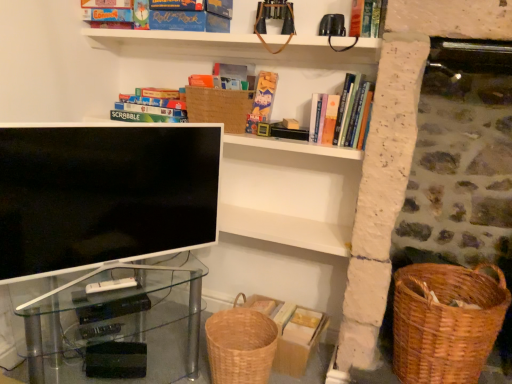
What do you see at coordinates (151, 106) in the screenshot? This screenshot has width=512, height=384. I see `matte cardboard scrabble board game at upper left, which is the first book from left to right` at bounding box center [151, 106].

Locate an element on the screen. The image size is (512, 384). matte cardboard book at upper center, the second book in the left-to-right sequence is located at coordinates (262, 101).

Locate an element on the screen. hardcover book at upper center, which is the fourth book in left-to-right order is located at coordinates coord(365,18).

Locate an element on the screen. transparent glass computer desk at lower left is located at coordinates (115, 322).

Describe the element at coordinates (342, 113) in the screenshot. The image size is (512, 384). I see `hardcover book at upper right, marked as the second book in a right-to-left arrangement` at that location.

Identify the location of hardcover book at upper right, marked as the second book in a right-to-left arrangement. Image resolution: width=512 pixels, height=384 pixels. (342, 113).

Where is `woven brown basket at lower right, positioned as the 1th basket container in right-to-left order`? The image size is (512, 384). woven brown basket at lower right, positioned as the 1th basket container in right-to-left order is located at coordinates (446, 322).

In order to face woven brown basket at lower center, arranged as the 2th basket container when viewed from the right, should I rotate leftwards or rightwards?

To align with it, rotate left about 2.367°.

Describe the element at coordinates (240, 345) in the screenshot. I see `woven brown basket at lower center, positioned as the first basket container in left-to-right order` at that location.

Locate an element on the screen. matte cardboard scrabble board game at upper left, which is the fourth book from right to left is located at coordinates (151, 106).

From the image's perspective, between woven brown basket at lower right, positioned as the 1th basket container in right-to-left order, and matte cardboard book at upper center, positioned as the third book in right-to-left order, who is located below?

woven brown basket at lower right, positioned as the 1th basket container in right-to-left order, is shown below in the image.

Considering their positions, is woven brown basket at lower right, positioned as the 1th basket container in right-to-left order, located in front of or behind matte cardboard book at upper center, the second book in the left-to-right sequence?

Clearly, woven brown basket at lower right, positioned as the 1th basket container in right-to-left order, is in front of matte cardboard book at upper center, the second book in the left-to-right sequence.

Which of these two, woven brown basket at lower right, positioned as the 1th basket container in right-to-left order, or matte cardboard book at upper center, positioned as the third book in right-to-left order, is smaller?

With smaller size is matte cardboard book at upper center, positioned as the third book in right-to-left order.

Is woven brown basket at lower center, positioned as the first basket container in left-to-right order, next to matte white tv at center and touching it?

No, woven brown basket at lower center, positioned as the first basket container in left-to-right order, is not in contact with matte white tv at center.

Based on the photo, from the image's perspective, who appears lower, woven brown basket at lower center, positioned as the first basket container in left-to-right order, or matte white tv at center?

woven brown basket at lower center, positioned as the first basket container in left-to-right order, from the image's perspective.

In terms of size, does woven brown basket at lower center, arranged as the 2th basket container when viewed from the right, appear bigger or smaller than matte white tv at center?

In the image, woven brown basket at lower center, arranged as the 2th basket container when viewed from the right, appears to be smaller than matte white tv at center.

Would you say woven brown basket at lower center, arranged as the 2th basket container when viewed from the right, is to the left or to the right of matte white tv at center in the picture?

From the image, it's evident that woven brown basket at lower center, arranged as the 2th basket container when viewed from the right, is to the right of matte white tv at center.

Which object is positioned more to the left, hardcover book at upper right, marked as the second book in a right-to-left arrangement, or woven brown basket at lower right, positioned as the 1th basket container in right-to-left order?

Positioned to the left is hardcover book at upper right, marked as the second book in a right-to-left arrangement.

Can you confirm if hardcover book at upper right, marked as the 3th book in a left-to-right arrangement, is wider than woven brown basket at lower right, positioned as the 1th basket container in right-to-left order?

In fact, hardcover book at upper right, marked as the 3th book in a left-to-right arrangement, might be narrower than woven brown basket at lower right, positioned as the 1th basket container in right-to-left order.

From a real-world perspective, is hardcover book at upper right, marked as the second book in a right-to-left arrangement, below woven brown basket at lower right, arranged as the second basket container when viewed from the left?

No, from a real-world perspective, hardcover book at upper right, marked as the second book in a right-to-left arrangement, is not below woven brown basket at lower right, arranged as the second basket container when viewed from the left.

Can we say hardcover book at upper right, marked as the second book in a right-to-left arrangement, lies outside woven brown basket at lower right, positioned as the 1th basket container in right-to-left order?

Indeed, hardcover book at upper right, marked as the second book in a right-to-left arrangement, is completely outside woven brown basket at lower right, positioned as the 1th basket container in right-to-left order.

From the image's perspective, does matte cardboard scrabble board game at upper left, which is the fourth book from right to left, appear lower than matte cardboard book at upper center, positioned as the third book in right-to-left order?

No, from the image's perspective, matte cardboard scrabble board game at upper left, which is the fourth book from right to left, is not beneath matte cardboard book at upper center, positioned as the third book in right-to-left order.

Which of these two, matte cardboard scrabble board game at upper left, which is the fourth book from right to left, or matte cardboard book at upper center, the second book in the left-to-right sequence, is wider?

matte cardboard book at upper center, the second book in the left-to-right sequence, is wider.

How distant is matte cardboard scrabble board game at upper left, which is the fourth book from right to left, from matte cardboard book at upper center, positioned as the third book in right-to-left order?

42.86 centimeters.

Which is more to the left, matte cardboard scrabble board game at upper left, which is the fourth book from right to left, or matte cardboard book at upper center, positioned as the third book in right-to-left order?

From the viewer's perspective, matte cardboard scrabble board game at upper left, which is the fourth book from right to left, appears more on the left side.

Is matte white tv at center aimed at woven brown basket at upper center?

No, matte white tv at center is not facing towards woven brown basket at upper center.

Is matte white tv at center beside woven brown basket at upper center?

matte white tv at center and woven brown basket at upper center are clearly separated.

Is matte white tv at center to the left or to the right of woven brown basket at upper center in the image?

matte white tv at center is positioned on woven brown basket at upper center's left side.

Is hardcover book at upper right, marked as the 3th book in a left-to-right arrangement, facing towards woven brown basket at upper center?

No, hardcover book at upper right, marked as the 3th book in a left-to-right arrangement, does not turn towards woven brown basket at upper center.

Considering the sizes of objects hardcover book at upper right, marked as the 3th book in a left-to-right arrangement, and woven brown basket at upper center in the image provided, who is wider, hardcover book at upper right, marked as the 3th book in a left-to-right arrangement, or woven brown basket at upper center?

hardcover book at upper right, marked as the 3th book in a left-to-right arrangement.

Consider the image. Considering the sizes of objects hardcover book at upper right, marked as the 3th book in a left-to-right arrangement, and woven brown basket at upper center in the image provided, who is bigger, hardcover book at upper right, marked as the 3th book in a left-to-right arrangement, or woven brown basket at upper center?

woven brown basket at upper center is bigger.

From a real-world perspective, who is located higher, hardcover book at upper right, marked as the second book in a right-to-left arrangement, or woven brown basket at upper center?

In real-world perspective, hardcover book at upper right, marked as the second book in a right-to-left arrangement, is above.

Is point (481, 265) closer to camera compared to point (144, 106)?

Yes.

From the image's perspective, which one is positioned lower, woven brown basket at lower right, positioned as the 1th basket container in right-to-left order, or matte cardboard scrabble board game at upper left, which is the first book from left to right?

woven brown basket at lower right, positioned as the 1th basket container in right-to-left order, is shown below in the image.

Is matte cardboard scrabble board game at upper left, which is the fourth book from right to left, at the back of woven brown basket at lower right, arranged as the second basket container when viewed from the left?

No, woven brown basket at lower right, arranged as the second basket container when viewed from the left, is not facing the opposite direction of matte cardboard scrabble board game at upper left, which is the fourth book from right to left.

Considering the relative positions of woven brown basket at lower right, arranged as the second basket container when viewed from the left, and matte cardboard scrabble board game at upper left, which is the fourth book from right to left, in the image provided, is woven brown basket at lower right, arranged as the second basket container when viewed from the left, in front of matte cardboard scrabble board game at upper left, which is the fourth book from right to left,?

Yes, it is in front of matte cardboard scrabble board game at upper left, which is the fourth book from right to left.

The image size is (512, 384). I want to click on basket container that is the 1st one below the matte cardboard book at upper center, positioned as the third book in right-to-left order (from a real-world perspective), so click(x=446, y=322).

From the image's perspective, starting from the matte white tv at center, which basket container is the 2nd one below? Please provide its 2D coordinates.

[(240, 345)]

Which object lies further to the anchor point transparent glass computer desk at lower left, hardcover book at upper right, marked as the 3th book in a left-to-right arrangement, or woven brown basket at lower center, arranged as the 2th basket container when viewed from the right?

Among the two, hardcover book at upper right, marked as the 3th book in a left-to-right arrangement, is located further to transparent glass computer desk at lower left.

Based on their spatial positions, is matte cardboard scrabble board game at upper left, which is the first book from left to right, or hardcover book at upper right, marked as the 3th book in a left-to-right arrangement, further from matte cardboard book at upper center, the second book in the left-to-right sequence?

matte cardboard scrabble board game at upper left, which is the first book from left to right, lies further to matte cardboard book at upper center, the second book in the left-to-right sequence, than the other object.

Considering their positions, is woven brown basket at lower center, positioned as the first basket container in left-to-right order, positioned further to matte cardboard scrabble board game at upper left, which is the first book from left to right, than woven brown basket at lower right, positioned as the 1th basket container in right-to-left order?

woven brown basket at lower right, positioned as the 1th basket container in right-to-left order, is positioned further to the anchor matte cardboard scrabble board game at upper left, which is the first book from left to right.

Estimate the real-world distances between objects in this image. Which object is closer to hardcover book at upper right, marked as the 3th book in a left-to-right arrangement, hardcover book at upper center, which is the fourth book in left-to-right order, or woven brown basket at upper center?

Based on the image, hardcover book at upper center, which is the fourth book in left-to-right order, appears to be nearer to hardcover book at upper right, marked as the 3th book in a left-to-right arrangement.

Estimate the real-world distances between objects in this image. Which object is closer to woven brown basket at lower center, positioned as the first basket container in left-to-right order, woven brown basket at upper center or matte cardboard scrabble board game at upper left, which is the first book from left to right?

woven brown basket at upper center lies closer to woven brown basket at lower center, positioned as the first basket container in left-to-right order, than the other object.

When comparing their distances from woven brown basket at upper center, does woven brown basket at lower center, positioned as the first basket container in left-to-right order, or matte cardboard scrabble board game at upper left, which is the first book from left to right, seem further?

Among the two, woven brown basket at lower center, positioned as the first basket container in left-to-right order, is located further to woven brown basket at upper center.

Estimate the real-world distances between objects in this image. Which object is closer to matte cardboard book at upper center, positioned as the third book in right-to-left order, hardcover book at upper center, which is the fourth book in left-to-right order, or matte cardboard scrabble board game at upper left, which is the fourth book from right to left?

matte cardboard scrabble board game at upper left, which is the fourth book from right to left.

Which object lies nearer to the anchor point matte white tv at center, transparent glass computer desk at lower left or hardcover book at upper center, acting as the first book starting from the right?

Based on the image, transparent glass computer desk at lower left appears to be nearer to matte white tv at center.

Where is `television between matte cardboard book at upper center, the second book in the left-to-right sequence, and transparent glass computer desk at lower left vertically`? The height and width of the screenshot is (384, 512). television between matte cardboard book at upper center, the second book in the left-to-right sequence, and transparent glass computer desk at lower left vertically is located at coordinates (104, 195).

You are a GUI agent. You are given a task and a screenshot of the screen. Output one action in this format:
    pyautogui.click(x=<x>, y=<y>)
    Task: Click on the book between matte cardboard book at upper center, positioned as the third book in right-to-left order, and transparent glass computer desk at lower left vertically
    Image resolution: width=512 pixels, height=384 pixels.
    Given the screenshot: What is the action you would take?
    pyautogui.click(x=342, y=113)

Where is `book between woven brown basket at upper center and transparent glass computer desk at lower left vertically`? Image resolution: width=512 pixels, height=384 pixels. book between woven brown basket at upper center and transparent glass computer desk at lower left vertically is located at coordinates (342, 113).

At what (x,y) coordinates should I click in order to perform the action: click on television between hardcover book at upper center, acting as the first book starting from the right, and transparent glass computer desk at lower left, in the vertical direction. Please return your answer as a coordinate pair (x, y). Looking at the image, I should click on (104, 195).